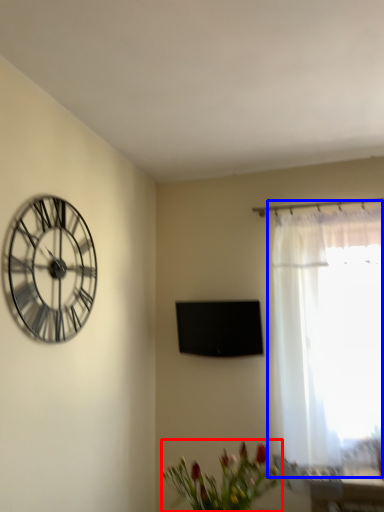
Question: Among these objects, which one is farthest to the camera, floral arrangement (highlighted by a red box) or window (highlighted by a blue box)?

Choices:
 (A) floral arrangement
 (B) window

Answer: (B)